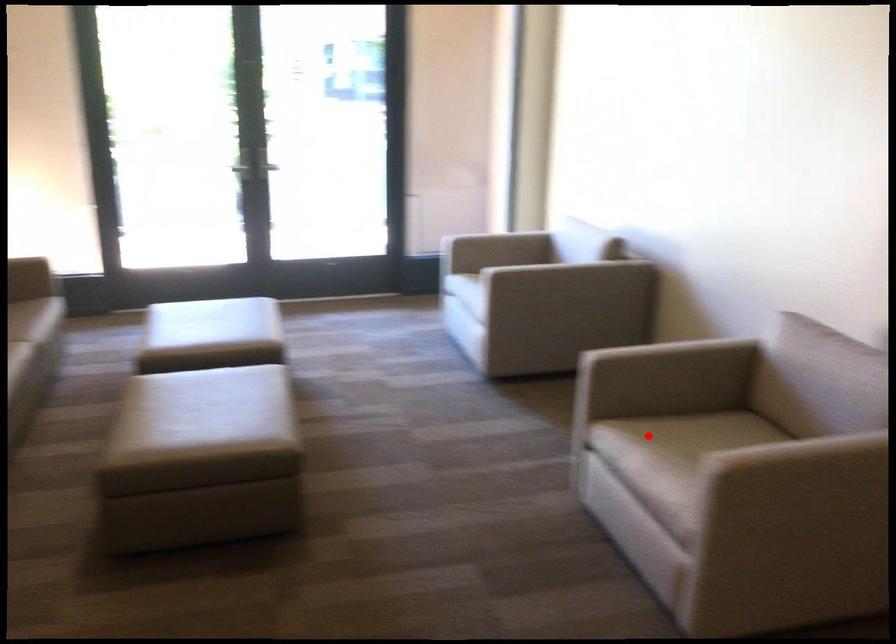
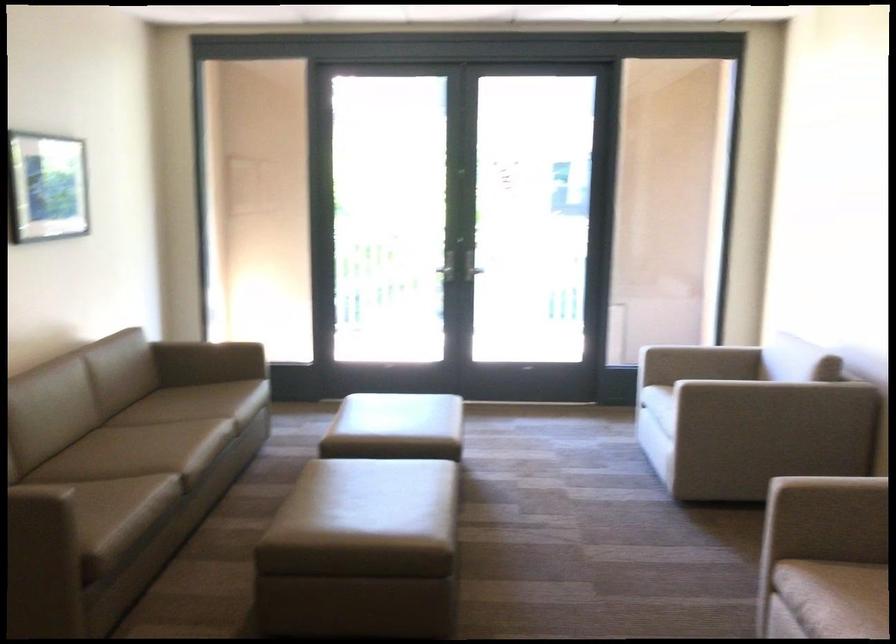
Question: I am providing you with two images of the same scene from different viewpoints. A red point is shown in image1. For the corresponding object point in image2, is it positioned nearer or farther from the camera?

Choices:
 (A) Nearer
 (B) Farther

Answer: (A)